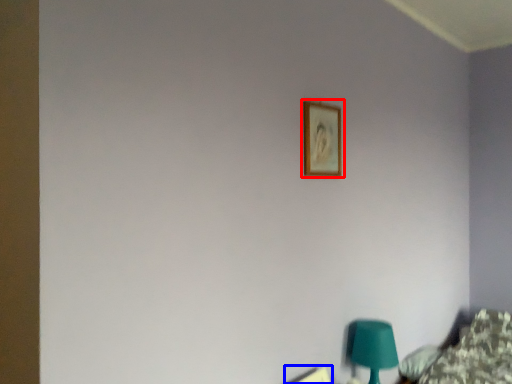
Question: Which of the following is the closest to the observer, picture frame (highlighted by a red box) or picture frame (highlighted by a blue box)?

Choices:
 (A) picture frame
 (B) picture frame

Answer: (B)